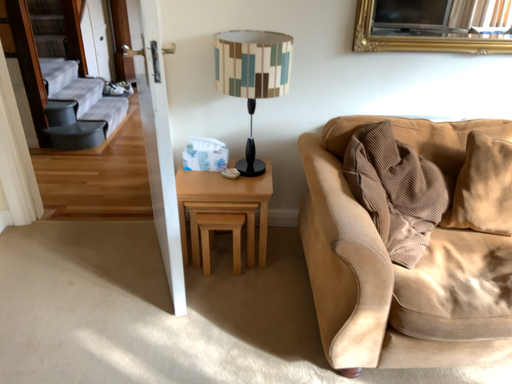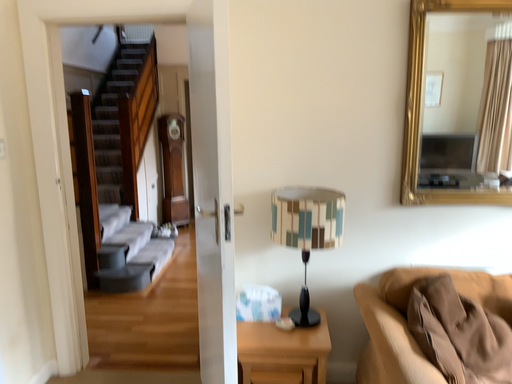
Question: Which way did the camera rotate in the video?

Choices:
 (A) rotated upward
 (B) rotated downward

Answer: (A)